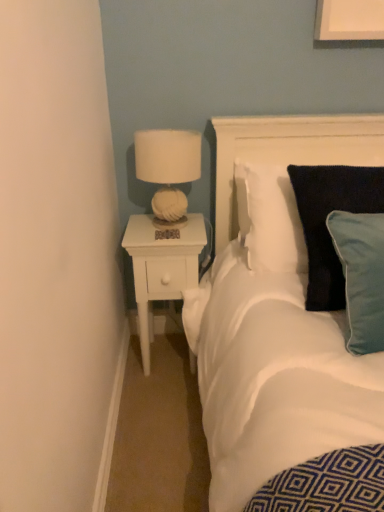
Question: Would you consider white wood nightstand at left to be distant from velvety dark blue pillow at right?

Choices:
 (A) no
 (B) yes

Answer: (A)

Question: From a real-world perspective, is white wood nightstand at left physically above velvety dark blue pillow at right?

Choices:
 (A) no
 (B) yes

Answer: (A)

Question: Can we say white wood nightstand at left lies outside velvety dark blue pillow at right?

Choices:
 (A) yes
 (B) no

Answer: (A)

Question: Is white wood nightstand at left positioned behind velvety dark blue pillow at right?

Choices:
 (A) yes
 (B) no

Answer: (A)

Question: Is white wood nightstand at left looking in the opposite direction of velvety dark blue pillow at right?

Choices:
 (A) no
 (B) yes

Answer: (A)

Question: Considering the positions of white fabric lampshade at upper right and white fabric headboard at upper right in the image, is white fabric lampshade at upper right taller or shorter than white fabric headboard at upper right?

Choices:
 (A) short
 (B) tall

Answer: (A)

Question: Is white fabric lampshade at upper right bigger or smaller than white fabric headboard at upper right?

Choices:
 (A) small
 (B) big

Answer: (A)

Question: Considering the positions of white fabric lampshade at upper right and white fabric headboard at upper right in the image, is white fabric lampshade at upper right wider or thinner than white fabric headboard at upper right?

Choices:
 (A) thin
 (B) wide

Answer: (B)

Question: From a real-world perspective, is white fabric lampshade at upper right physically located above or below white fabric headboard at upper right?

Choices:
 (A) below
 (B) above

Answer: (B)

Question: From a real-world perspective, relative to white fabric lampshade at upper right, is velvety dark blue pillow at right vertically above or below?

Choices:
 (A) above
 (B) below

Answer: (B)

Question: Is velvety dark blue pillow at right bigger or smaller than white fabric lampshade at upper right?

Choices:
 (A) small
 (B) big

Answer: (B)

Question: From the image's perspective, is velvety dark blue pillow at right above or below white fabric lampshade at upper right?

Choices:
 (A) below
 (B) above

Answer: (A)

Question: Is velvety dark blue pillow at right inside or outside of white fabric lampshade at upper right?

Choices:
 (A) outside
 (B) inside

Answer: (A)

Question: Considering the positions of velvety dark blue pillow at right and white fabric headboard at upper right in the image, is velvety dark blue pillow at right taller or shorter than white fabric headboard at upper right?

Choices:
 (A) short
 (B) tall

Answer: (B)

Question: From the image's perspective, is velvety dark blue pillow at right located above or below white fabric headboard at upper right?

Choices:
 (A) above
 (B) below

Answer: (B)